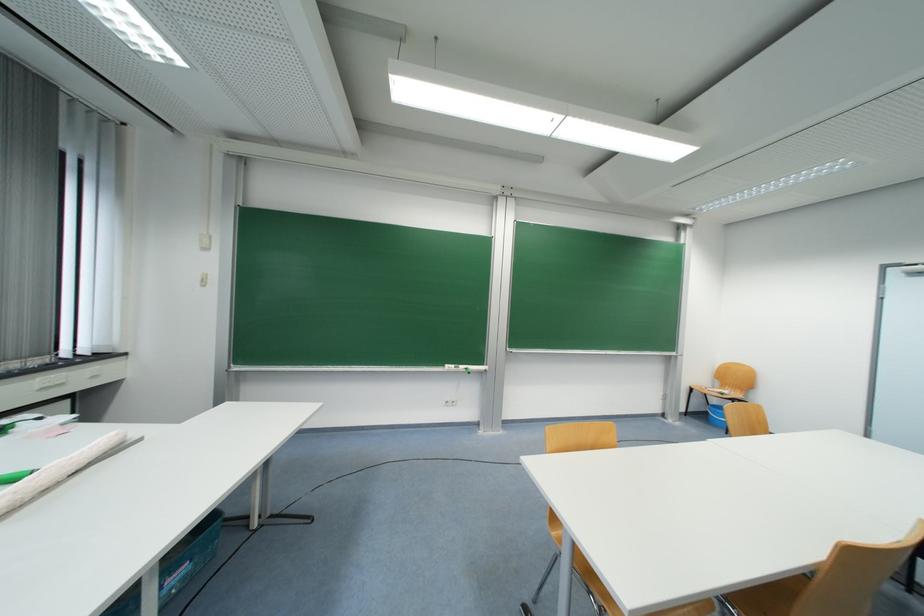
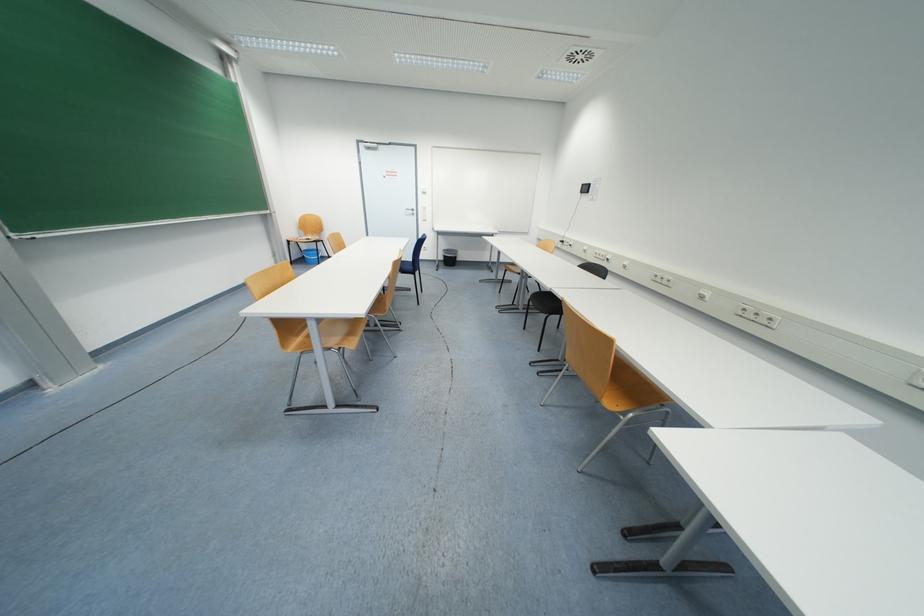
The point at (718, 403) is marked in the first image. Where is the corresponding point in the second image?

(309, 249)